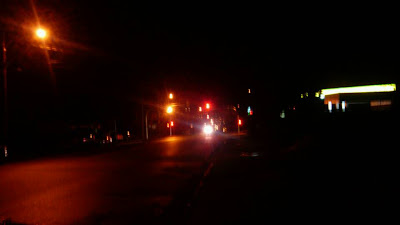
The width and height of the screenshot is (400, 225). Find the location of `reflection of interior light`. reflection of interior light is located at coordinates (364, 91).